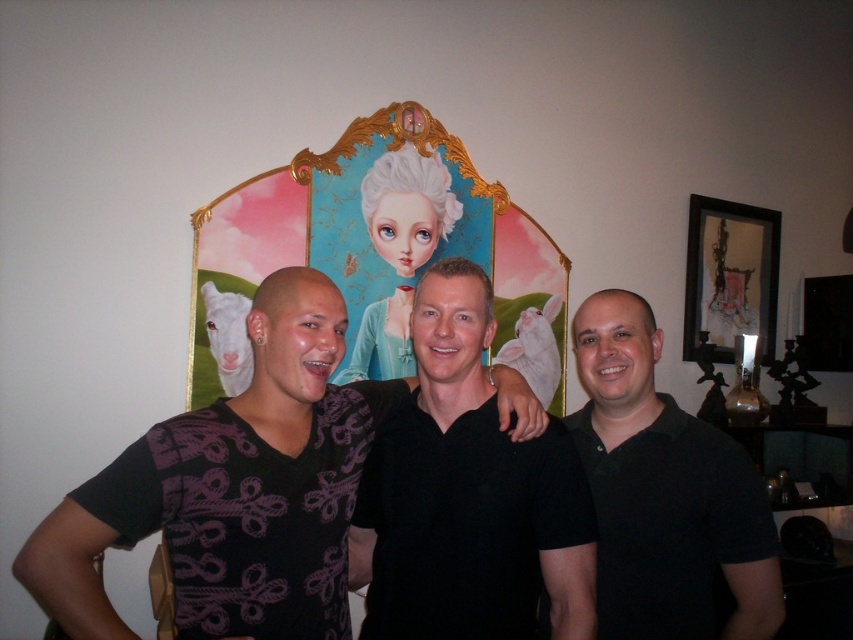
Is black matte shirt at right smaller than matte black picture frame at upper right?

Correct, black matte shirt at right occupies less space than matte black picture frame at upper right.

Does black matte shirt at right appear on the left side of matte black picture frame at upper right?

Indeed, black matte shirt at right is positioned on the left side of matte black picture frame at upper right.

The image size is (853, 640). What are the coordinates of `black matte shirt at right` in the screenshot? It's located at (664, 492).

Where is `black matte shirt at right`? black matte shirt at right is located at coordinates point(664,492).

Can you confirm if purple printed shirt at center is thinner than matte black picture frame at upper right?

In fact, purple printed shirt at center might be wider than matte black picture frame at upper right.

Who is more forward, (225,470) or (735,276)?

Point (225,470)

Identify the location of purple printed shirt at center. The width and height of the screenshot is (853, 640). (231, 490).

Is purple printed shirt at center bigger than black matte shirt at center?

Yes.

Does purple printed shirt at center have a smaller size compared to black matte shirt at center?

Actually, purple printed shirt at center might be larger than black matte shirt at center.

What do you see at coordinates (231, 490) in the screenshot?
I see `purple printed shirt at center` at bounding box center [231, 490].

Find the location of a particular element. purple printed shirt at center is located at coordinates (231, 490).